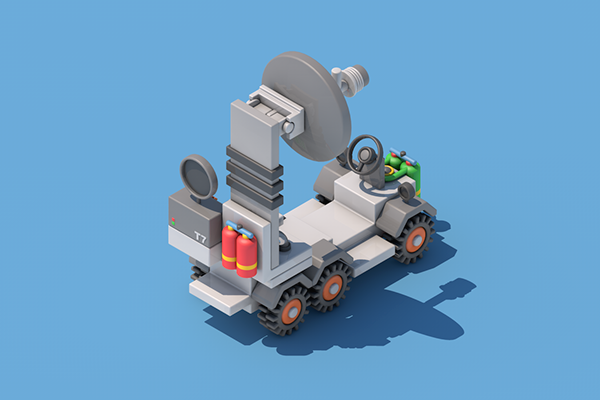
Where is `place to sit`? The width and height of the screenshot is (600, 400). place to sit is located at coordinates (335, 222).